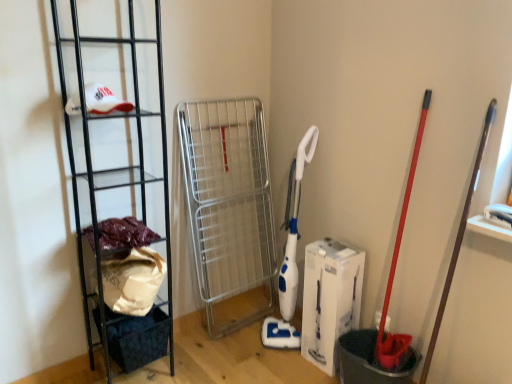
Question: Considering the relative sizes of fuzzy fabric at left and black metal rack at left in the image provided, is fuzzy fabric at left thinner than black metal rack at left?

Choices:
 (A) no
 (B) yes

Answer: (B)

Question: From a real-world perspective, is fuzzy fabric at left on black metal rack at left?

Choices:
 (A) yes
 (B) no

Answer: (B)

Question: Could you tell me if fuzzy fabric at left is facing black metal rack at left?

Choices:
 (A) no
 (B) yes

Answer: (B)

Question: Could black metal rack at left be considered to be inside fuzzy fabric at left?

Choices:
 (A) no
 (B) yes

Answer: (A)

Question: Is fuzzy fabric at left outside black metal rack at left?

Choices:
 (A) no
 (B) yes

Answer: (A)

Question: From the image's perspective, is fuzzy fabric at left located above black metal rack at left?

Choices:
 (A) yes
 (B) no

Answer: (B)

Question: Considering the relative sizes of dark blue fabric basket at lower left and fuzzy fabric at left in the image provided, is dark blue fabric basket at lower left wider than fuzzy fabric at left?

Choices:
 (A) yes
 (B) no

Answer: (A)

Question: Is dark blue fabric basket at lower left positioned far away from fuzzy fabric at left?

Choices:
 (A) yes
 (B) no

Answer: (B)

Question: Is dark blue fabric basket at lower left next to fuzzy fabric at left and touching it?

Choices:
 (A) no
 (B) yes

Answer: (A)

Question: Is fuzzy fabric at left at the back of dark blue fabric basket at lower left?

Choices:
 (A) yes
 (B) no

Answer: (B)

Question: Is dark blue fabric basket at lower left oriented towards fuzzy fabric at left?

Choices:
 (A) yes
 (B) no

Answer: (B)

Question: Considering the relative sizes of dark blue fabric basket at lower left and fuzzy fabric at left in the image provided, is dark blue fabric basket at lower left thinner than fuzzy fabric at left?

Choices:
 (A) no
 (B) yes

Answer: (A)

Question: Can you confirm if white cardboard box at center is bigger than dark blue fabric basket at lower left?

Choices:
 (A) no
 (B) yes

Answer: (B)